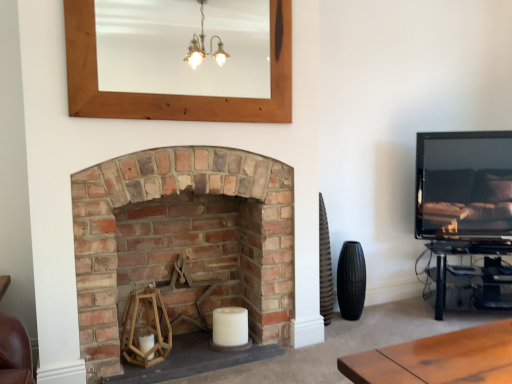
Where is `matte black tv at right`? The height and width of the screenshot is (384, 512). matte black tv at right is located at coordinates (464, 185).

This screenshot has height=384, width=512. Identify the location of rustic brick fireplace at center. (182, 239).

Based on the photo, is wooden mirror at upper center situated inside matte black tv at right or outside?

wooden mirror at upper center is not enclosed by matte black tv at right.

How different are the orientations of wooden mirror at upper center and matte black tv at right in degrees?

The angle between the facing direction of wooden mirror at upper center and the facing direction of matte black tv at right is 29.6 degrees.

From the image's perspective, is wooden mirror at upper center below matte black tv at right?

Actually, wooden mirror at upper center appears above matte black tv at right in the image.

Considering the relative sizes of wooden mirror at upper center and matte black tv at right in the image provided, is wooden mirror at upper center bigger than matte black tv at right?

Incorrect, wooden mirror at upper center is not larger than matte black tv at right.

Which object is more forward, matte black tv at right or wooden mirror at upper center?

wooden mirror at upper center is closer to the camera.

The width and height of the screenshot is (512, 384). Find the location of `picture frame above the matte black tv at right (from a real-world perspective)`. picture frame above the matte black tv at right (from a real-world perspective) is located at coordinates (168, 94).

In terms of size, does matte black tv at right appear bigger or smaller than wooden mirror at upper center?

Clearly, matte black tv at right is larger in size than wooden mirror at upper center.

Does point (450, 135) appear closer or farther from the camera than point (113, 344)?

Clearly, point (450, 135) is more distant from the camera than point (113, 344).

Between matte black tv at right and rustic brick fireplace at center, which one appears on the right side from the viewer's perspective?

matte black tv at right.

Based on the photo, which is correct: matte black tv at right is inside rustic brick fireplace at center, or outside of it?

matte black tv at right lies outside rustic brick fireplace at center.

From the picture: Between matte black tv at right and rustic brick fireplace at center, which one has smaller size?

matte black tv at right is smaller.

I want to click on picture frame in front of the rustic brick fireplace at center, so click(x=168, y=94).

Considering the relative sizes of rustic brick fireplace at center and wooden mirror at upper center in the image provided, is rustic brick fireplace at center bigger than wooden mirror at upper center?

Indeed, rustic brick fireplace at center has a larger size compared to wooden mirror at upper center.

From the picture: Do you think rustic brick fireplace at center is within wooden mirror at upper center, or outside of it?

rustic brick fireplace at center is not inside wooden mirror at upper center, it's outside.

Is rustic brick fireplace at center far away from matte black tv at right?

Yes, rustic brick fireplace at center is far from matte black tv at right.

Which object is positioned more to the right, rustic brick fireplace at center or matte black tv at right?

matte black tv at right is more to the right.

Locate an element on the screen. The width and height of the screenshot is (512, 384). television on the right side of rustic brick fireplace at center is located at coordinates (464, 185).

From a real-world perspective, which is physically above, rustic brick fireplace at center or matte black tv at right?

In real-world perspective, matte black tv at right is above.

Is wooden mirror at upper center outside of rustic brick fireplace at center?

That's correct, wooden mirror at upper center is outside of rustic brick fireplace at center.

Is wooden mirror at upper center thinner than rustic brick fireplace at center?

Yes, wooden mirror at upper center is thinner than rustic brick fireplace at center.

Which is less distant, [78,17] or [138,220]?

The point [78,17] is closer to the camera.

Is wooden mirror at upper center aimed at rustic brick fireplace at center?

No, wooden mirror at upper center is not facing towards rustic brick fireplace at center.

Where is `television below the wooden mirror at upper center (from a real-world perspective)`? television below the wooden mirror at upper center (from a real-world perspective) is located at coordinates 464,185.

At what (x,y) coordinates should I click in order to perform the action: click on television that appears behind the wooden mirror at upper center. Please return your answer as a coordinate pair (x, y). The height and width of the screenshot is (384, 512). Looking at the image, I should click on (464, 185).

Looking at the image, which one is located closer to matte black tv at right, rustic brick fireplace at center or wooden mirror at upper center?

wooden mirror at upper center.

Looking at the image, which one is located closer to wooden mirror at upper center, matte black tv at right or rustic brick fireplace at center?

Based on the image, rustic brick fireplace at center appears to be nearer to wooden mirror at upper center.

When comparing their distances from rustic brick fireplace at center, does wooden mirror at upper center or matte black tv at right seem closer?

The object closer to rustic brick fireplace at center is wooden mirror at upper center.

Based on their spatial positions, is matte black tv at right or wooden mirror at upper center closer to rustic brick fireplace at center?

The object closer to rustic brick fireplace at center is wooden mirror at upper center.

Looking at the image, which one is located closer to wooden mirror at upper center, rustic brick fireplace at center or matte black tv at right?

rustic brick fireplace at center is positioned closer to the anchor wooden mirror at upper center.

When comparing their distances from matte black tv at right, does wooden mirror at upper center or rustic brick fireplace at center seem closer?

wooden mirror at upper center.

Where is `picture frame between rustic brick fireplace at center and matte black tv at right in the horizontal direction`? The height and width of the screenshot is (384, 512). picture frame between rustic brick fireplace at center and matte black tv at right in the horizontal direction is located at coordinates (168, 94).